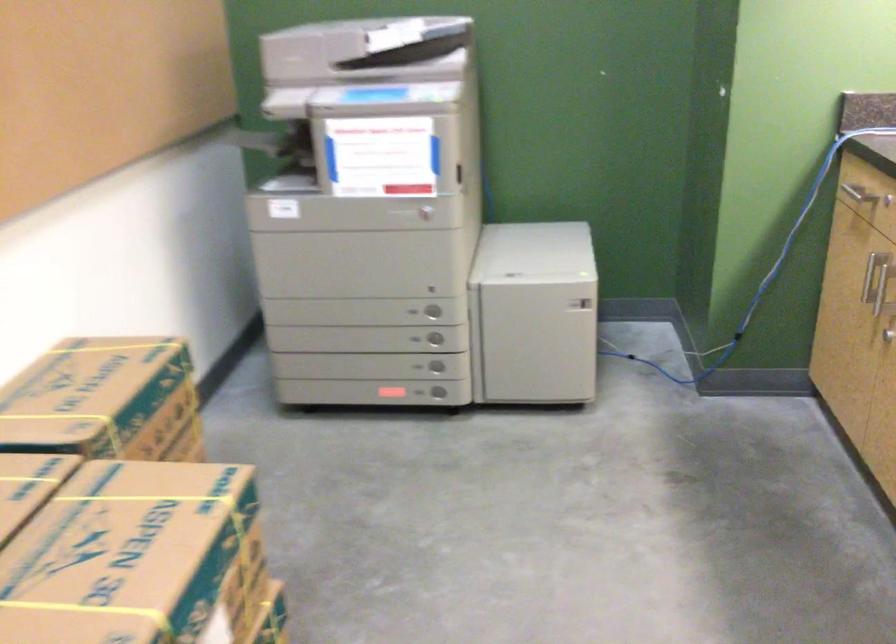
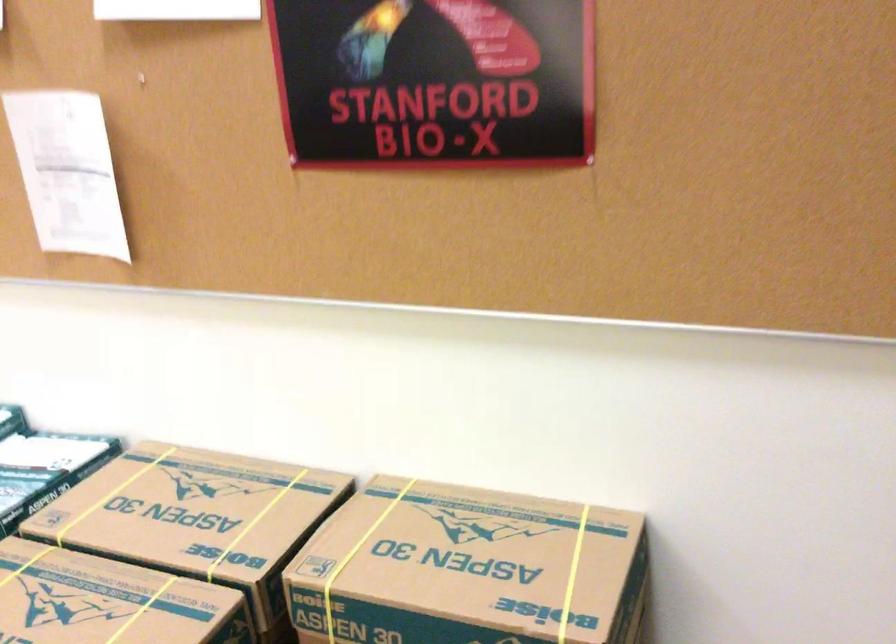
Where in the second image is the point corresponding to pixel 93 518 from the first image?

(108, 601)